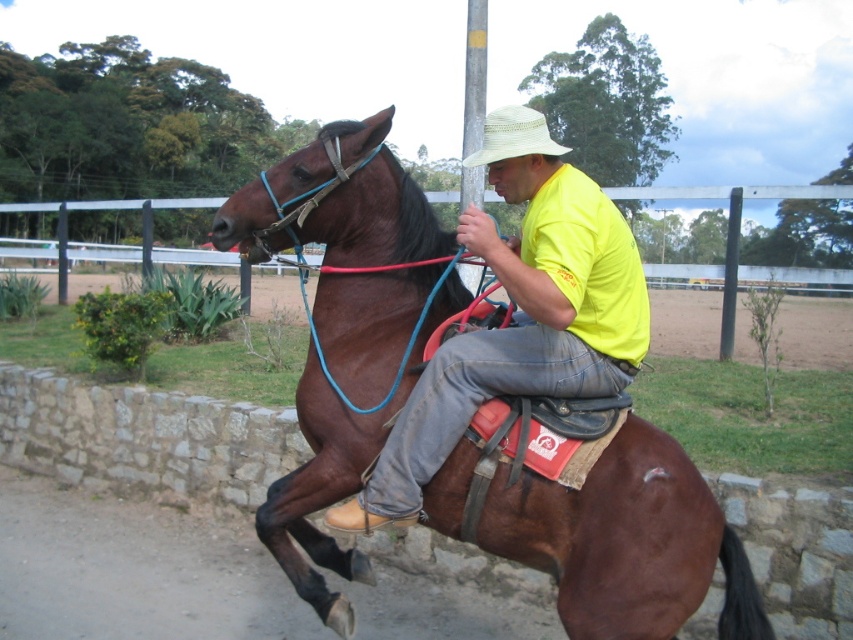
Can you confirm if shiny brown horse at center is smaller than yellow matte shirt at center?

Yes, shiny brown horse at center is smaller than yellow matte shirt at center.

Who is shorter, shiny brown horse at center or yellow matte shirt at center?

With less height is yellow matte shirt at center.

Does point (527, 497) come behind point (408, 474)?

No, (527, 497) is in front of (408, 474).

Locate an element on the screen. The image size is (853, 640). shiny brown horse at center is located at coordinates (633, 545).

Does shiny brown horse at center have a larger size compared to natural straw cowboy hat at center?

No, shiny brown horse at center is not bigger than natural straw cowboy hat at center.

Who is positioned more to the left, shiny brown horse at center or natural straw cowboy hat at center?

From the viewer's perspective, shiny brown horse at center appears more on the left side.

Between point (672, 608) and point (505, 134), which one is positioned behind?

The point (505, 134) is more distant.

Locate an element on the screen. Image resolution: width=853 pixels, height=640 pixels. shiny brown horse at center is located at coordinates (633, 545).

Does yellow matte shirt at center appear on the right side of natural straw cowboy hat at center?

Incorrect, yellow matte shirt at center is not on the right side of natural straw cowboy hat at center.

Is yellow matte shirt at center positioned in front of natural straw cowboy hat at center?

No.

Is point (451, 440) positioned before point (525, 128)?

Yes, point (451, 440) is in front of point (525, 128).

Find the location of `yellow matte shirt at center`. yellow matte shirt at center is located at coordinates (521, 308).